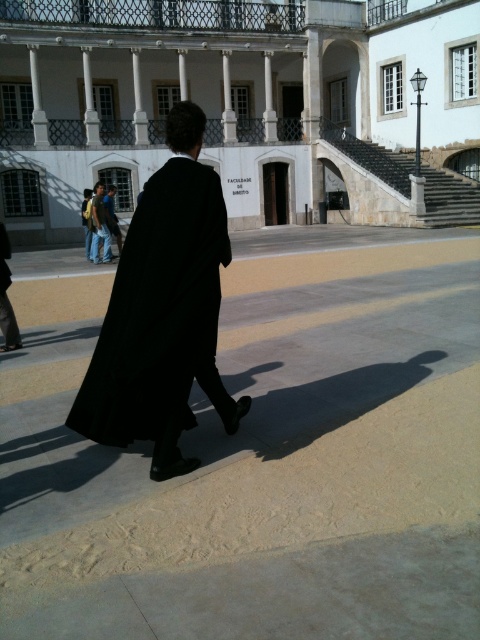
You are a photographer trying to capture a wide shot of the white stone building at center without the black matte coat at center blocking the view. Based on their sizes, which object should you focus on to ensure the building is the main subject?

The white stone building at center is wider than the black matte coat at center, so focusing on the building will ensure it is the main subject in the photo.

You are a photographer setting up for an event at the law faculty building. You need to position a light source so that it illuminates the black matte coat at center without casting a shadow on the denim jeans at lower left. Based on the current scene, is this possible?

The black matte coat at center is in front of the denim jeans at lower left, so positioning the light source behind the coat would cast its shadow onto the jeans. Therefore, it is not possible to illuminate the coat without casting a shadow on the jeans.